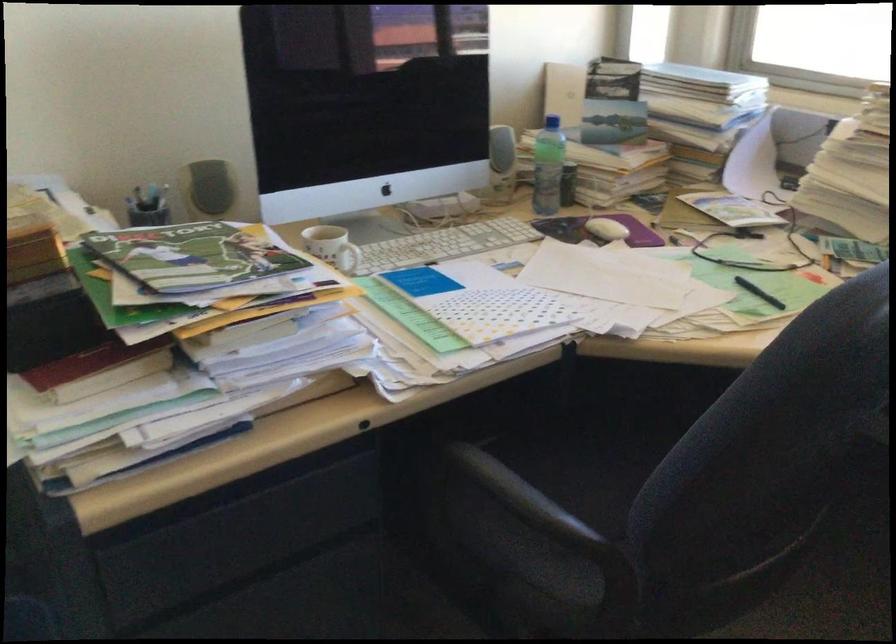
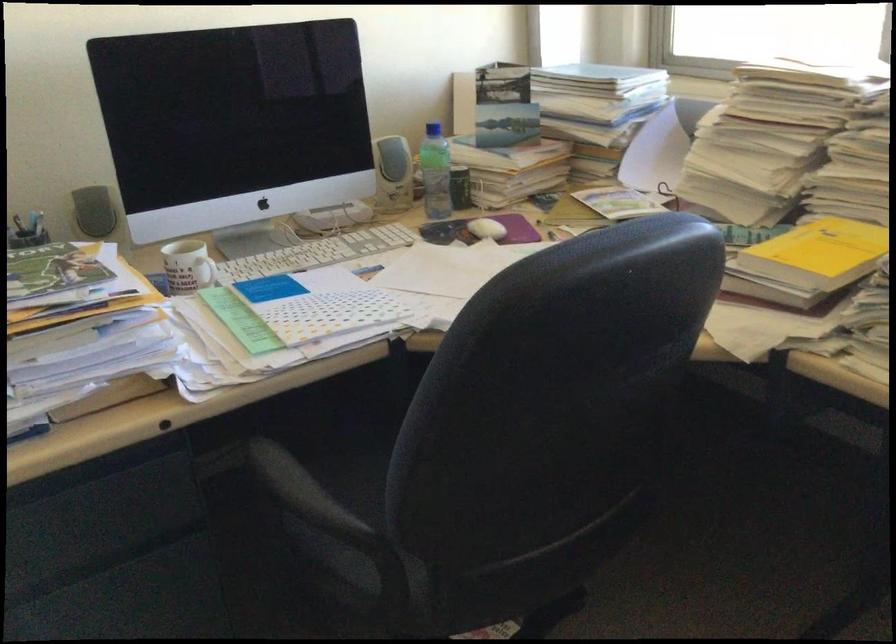
Question: I am providing you with two images of the same scene from different viewpoints. Please identify which objects are invisible in image2.

Choices:
 (A) orange Fanta bottle
 (B) black chair sitting surface
 (C) blue bottle cap
 (D) yellow book

Answer: (B)